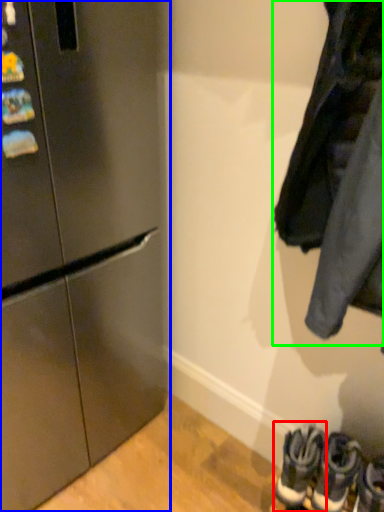
Question: Estimate the real-world distances between objects in this image. Which object is closer to footwear (highlighted by a red box), refrigerator (highlighted by a blue box) or jacket (highlighted by a green box)?

Choices:
 (A) refrigerator
 (B) jacket

Answer: (B)